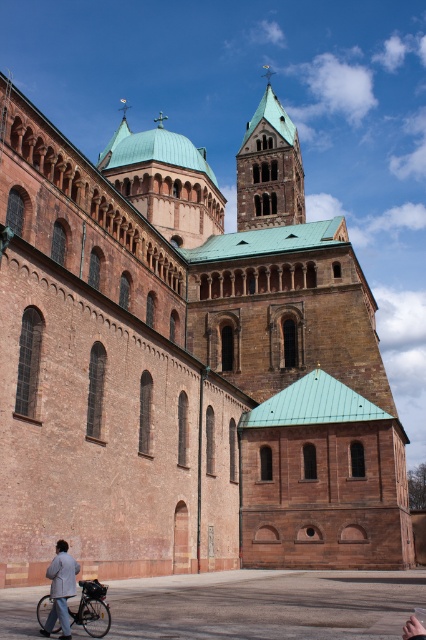
Which is below, brown stone tower at upper center or light gray fabric jacket at lower left?

light gray fabric jacket at lower left is below.

Can you confirm if brown stone tower at upper center is smaller than light gray fabric jacket at lower left?

Incorrect, brown stone tower at upper center is not smaller in size than light gray fabric jacket at lower left.

Identify the location of brown stone tower at upper center. (270, 170).

The height and width of the screenshot is (640, 426). Identify the location of brown stone tower at upper center. (270, 170).

Does brown stone tower at upper center have a larger size compared to silver metallic bicycle at lower left?

Correct, brown stone tower at upper center is larger in size than silver metallic bicycle at lower left.

Between point (282, 186) and point (89, 584), which one is positioned in front?

Point (89, 584) is in front.

Is point (282, 122) positioned after point (85, 592)?

Yes.

Where is `brown stone tower at upper center`? The image size is (426, 640). brown stone tower at upper center is located at coordinates (270, 170).

How far apart are silver metallic bicycle at lower left and light gray fabric jacket at lower left?

silver metallic bicycle at lower left and light gray fabric jacket at lower left are 1.16 meters apart.

Is silver metallic bicycle at lower left shorter than light gray fabric jacket at lower left?

In fact, silver metallic bicycle at lower left may be taller than light gray fabric jacket at lower left.

Image resolution: width=426 pixels, height=640 pixels. I want to click on silver metallic bicycle at lower left, so click(92, 609).

I want to click on silver metallic bicycle at lower left, so click(x=92, y=609).